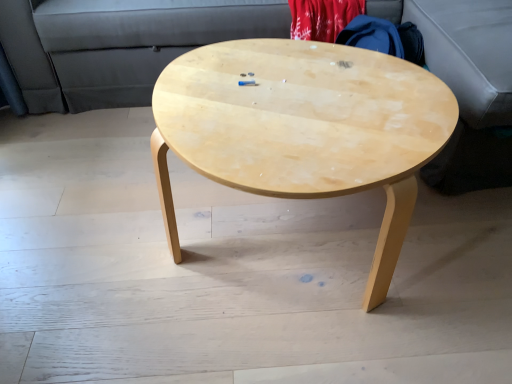
Question: Considering the positions of natural wood coffee table at center and matte gray couch at upper center in the image, is natural wood coffee table at center taller or shorter than matte gray couch at upper center?

Choices:
 (A) short
 (B) tall

Answer: (A)

Question: Considering the positions of point (173, 87) and point (25, 54), is point (173, 87) closer or farther from the camera than point (25, 54)?

Choices:
 (A) closer
 (B) farther

Answer: (A)

Question: From a real-world perspective, is natural wood coffee table at center above or below matte gray couch at upper center?

Choices:
 (A) below
 (B) above

Answer: (A)

Question: From a real-world perspective, is matte gray couch at upper center positioned above or below natural wood coffee table at center?

Choices:
 (A) below
 (B) above

Answer: (B)

Question: Is matte gray couch at upper center bigger or smaller than natural wood coffee table at center?

Choices:
 (A) small
 (B) big

Answer: (B)

Question: In the image, is matte gray couch at upper center on the left side or the right side of natural wood coffee table at center?

Choices:
 (A) left
 (B) right

Answer: (A)

Question: Is matte gray couch at upper center taller or shorter than natural wood coffee table at center?

Choices:
 (A) tall
 (B) short

Answer: (A)